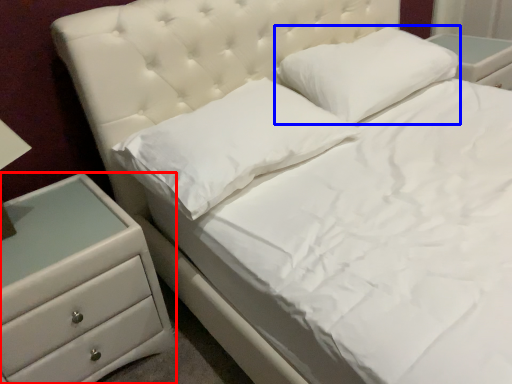
Question: Among these objects, which one is nearest to the camera, chest of drawers (highlighted by a red box) or pillow (highlighted by a blue box)?

Choices:
 (A) chest of drawers
 (B) pillow

Answer: (A)